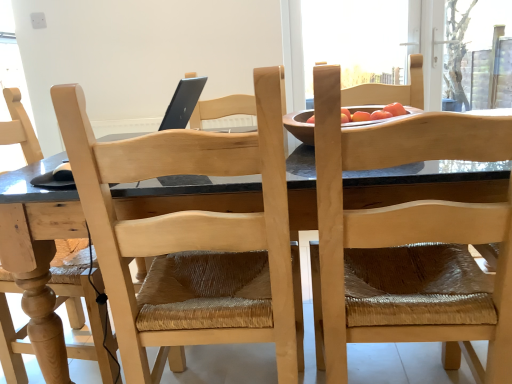
Question: From a real-world perspective, is natural wood chair at upper right, which is counted as the second chair, starting from the left, below transparent glass window screen at upper center, positioned as the 2th window screen in right-to-left order?

Choices:
 (A) yes
 (B) no

Answer: (A)

Question: From the image's perspective, would you say natural wood chair at upper right, which is counted as the second chair, starting from the left, is positioned over transparent glass window screen at upper center, the 1th window screen in the left-to-right sequence?

Choices:
 (A) yes
 (B) no

Answer: (B)

Question: Would you say natural wood chair at upper right, which is counted as the second chair, starting from the left, is a long distance from transparent glass window screen at upper center, the 1th window screen in the left-to-right sequence?

Choices:
 (A) no
 (B) yes

Answer: (B)

Question: Is natural wood chair at upper right, marked as the first chair in a right-to-left arrangement, oriented away from transparent glass window screen at upper center, positioned as the 2th window screen in right-to-left order?

Choices:
 (A) no
 (B) yes

Answer: (A)

Question: From a real-world perspective, is natural wood chair at upper right, which is counted as the second chair, starting from the left, on transparent glass window screen at upper center, the 1th window screen in the left-to-right sequence?

Choices:
 (A) no
 (B) yes

Answer: (A)

Question: Does point tap(431, 322) appear closer or farther from the camera than point tap(387, 26)?

Choices:
 (A) farther
 (B) closer

Answer: (B)

Question: Looking at their shapes, would you say natural wood chair at upper right, marked as the first chair in a right-to-left arrangement, is wider or thinner than transparent glass window screen at upper center, positioned as the 2th window screen in right-to-left order?

Choices:
 (A) wide
 (B) thin

Answer: (A)

Question: Considering their positions, is natural wood chair at upper right, marked as the first chair in a right-to-left arrangement, located in front of or behind transparent glass window screen at upper center, positioned as the 2th window screen in right-to-left order?

Choices:
 (A) behind
 (B) front

Answer: (B)

Question: Visually, is natural wood chair at upper right, which is counted as the second chair, starting from the left, positioned to the left or to the right of transparent glass window screen at upper center, positioned as the 2th window screen in right-to-left order?

Choices:
 (A) left
 (B) right

Answer: (A)

Question: Is natural wood chair at upper right, which is counted as the second chair, starting from the left, in front of or behind natural wood chair at center, the first chair when ordered from left to right, in the image?

Choices:
 (A) front
 (B) behind

Answer: (A)

Question: Is natural wood chair at upper right, which is counted as the second chair, starting from the left, situated inside natural wood chair at center, the first chair when ordered from left to right, or outside?

Choices:
 (A) outside
 (B) inside

Answer: (A)

Question: Considering the relative positions of natural wood chair at upper right, marked as the first chair in a right-to-left arrangement, and natural wood chair at center, which appears as the 2th chair when viewed from the right, in the image provided, is natural wood chair at upper right, marked as the first chair in a right-to-left arrangement, to the left or to the right of natural wood chair at center, which appears as the 2th chair when viewed from the right,?

Choices:
 (A) left
 (B) right

Answer: (B)

Question: From the image's perspective, is natural wood chair at upper right, which is counted as the second chair, starting from the left, located above or below natural wood chair at center, which appears as the 2th chair when viewed from the right?

Choices:
 (A) below
 (B) above

Answer: (B)

Question: Considering the positions of transparent plastic screen at upper right, which is counted as the 2th window screen, starting from the left, and natural wood chair at upper right, which is counted as the second chair, starting from the left, in the image, is transparent plastic screen at upper right, which is counted as the 2th window screen, starting from the left, wider or thinner than natural wood chair at upper right, which is counted as the second chair, starting from the left,?

Choices:
 (A) wide
 (B) thin

Answer: (B)

Question: In the image, is transparent plastic screen at upper right, which is the first window screen in right-to-left order, on the left side or the right side of natural wood chair at upper right, marked as the first chair in a right-to-left arrangement?

Choices:
 (A) left
 (B) right

Answer: (B)